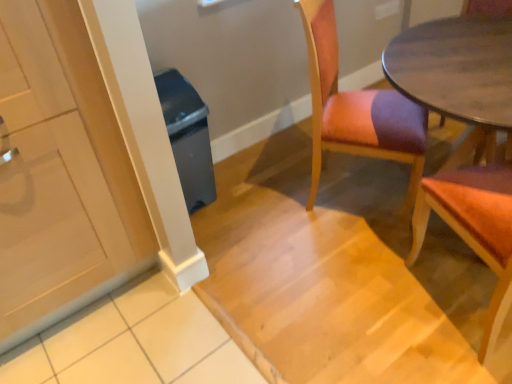
Identify the location of free space to the left of wooden chair at right, marked as the first chair in a right-to-left arrangement. This screenshot has width=512, height=384. (369, 306).